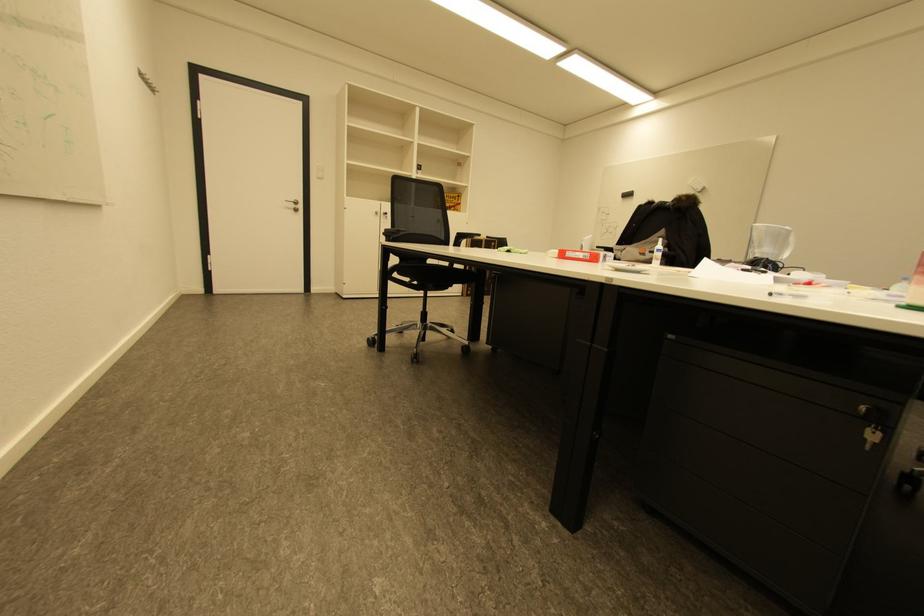
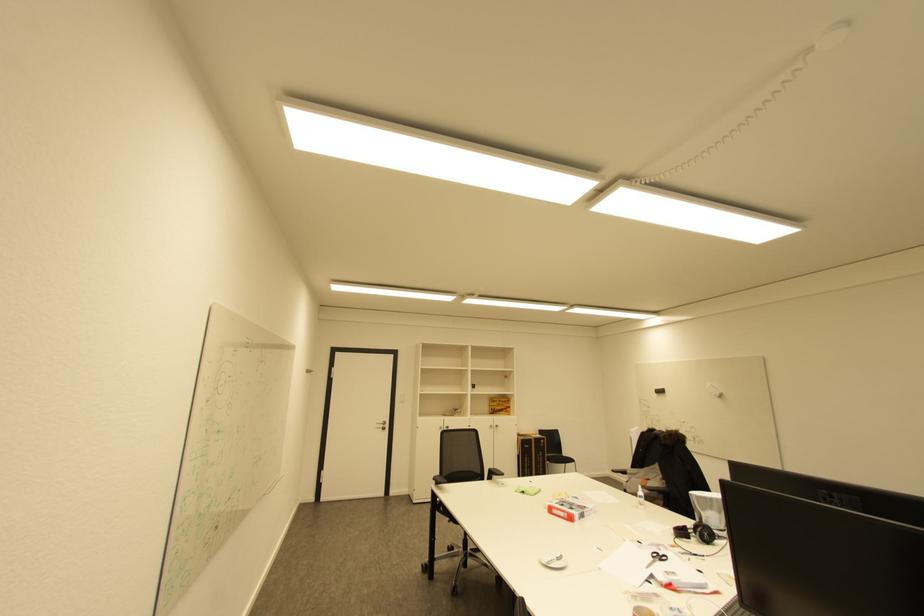
Locate, in the second image, the point that corresponds to pixel 454 245 in the first image.

(488, 479)